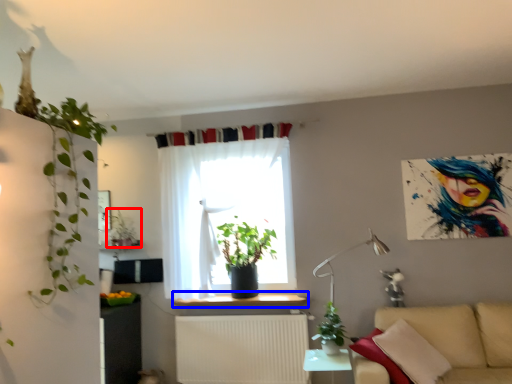
Question: Which point is closer to the camera, houseplant (highlighted by a red box) or window sill (highlighted by a blue box)?

Choices:
 (A) houseplant
 (B) window sill

Answer: (B)